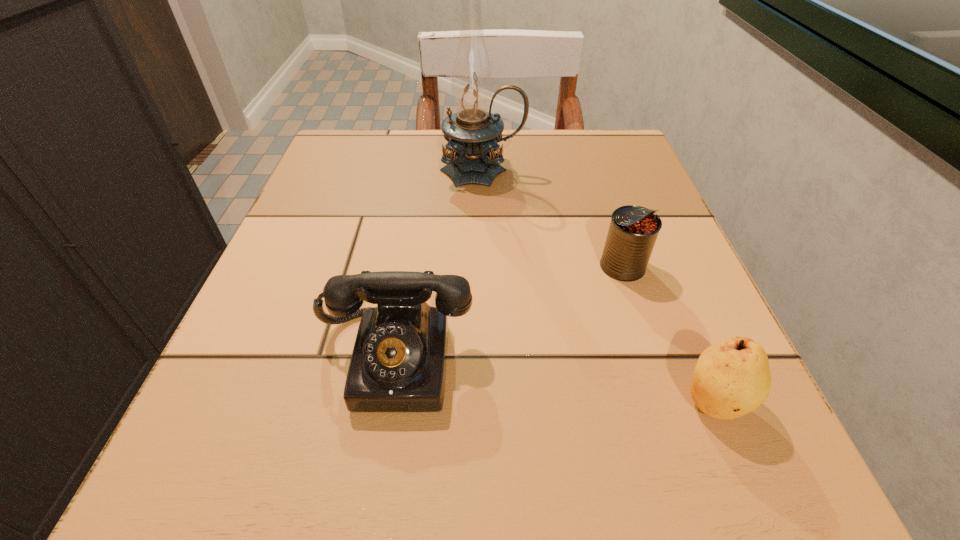
Identify the location of object that stands as the closest to the tallest object. (633, 231).

At what (x,y) coordinates should I click in order to perform the action: click on object that is the second closest to the telephone. Please return your answer as a coordinate pair (x, y). This screenshot has height=540, width=960. Looking at the image, I should click on (732, 378).

Where is `free point that satisfies the following two spatial constraints: 1. on the front side of the tallest object; 2. on the left side of the pear`? The width and height of the screenshot is (960, 540). free point that satisfies the following two spatial constraints: 1. on the front side of the tallest object; 2. on the left side of the pear is located at coordinates (484, 401).

Identify the location of free space that satisfies the following two spatial constraints: 1. on the front side of the third nearest object; 2. on the right side of the pear. This screenshot has width=960, height=540. (667, 401).

The height and width of the screenshot is (540, 960). I want to click on vacant area that satisfies the following two spatial constraints: 1. on the front side of the third nearest object; 2. on the left side of the oil lamp, so click(483, 266).

Locate an element on the screen. The width and height of the screenshot is (960, 540). free region that satisfies the following two spatial constraints: 1. on the dial of the pear; 2. on the left side of the telephone is located at coordinates (388, 401).

Image resolution: width=960 pixels, height=540 pixels. I want to click on free space that satisfies the following two spatial constraints: 1. on the dial of the telephone; 2. on the right side of the pear, so click(x=388, y=401).